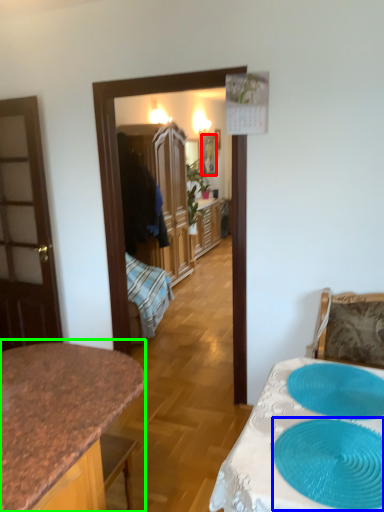
Question: Which object is positioned closest to picture frame (highlighted by a red box)? Select from oval (highlighted by a blue box) and countertop (highlighted by a green box).

Choices:
 (A) oval
 (B) countertop

Answer: (B)